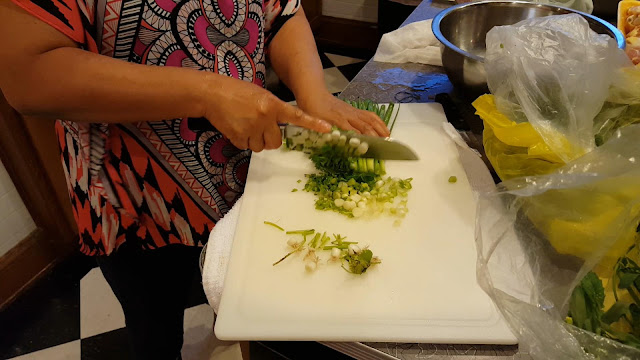
Find the location of `white wall`. white wall is located at coordinates (12, 222), (346, 10).